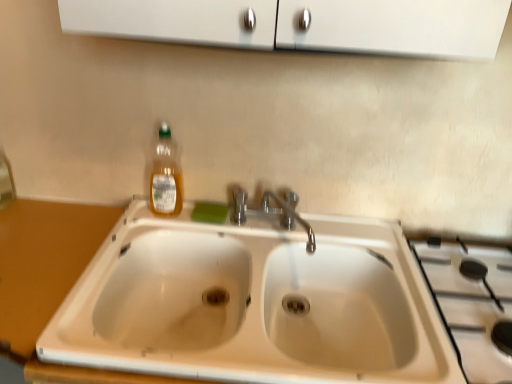
You are a GUI agent. You are given a task and a screenshot of the screen. Output one action in this format:
    pyautogui.click(x=<x>, y=<y>)
    Task: Click on the vacant space to the right of translucent plastic bottle at upper left
    
    Given the screenshot: What is the action you would take?
    pyautogui.click(x=201, y=218)